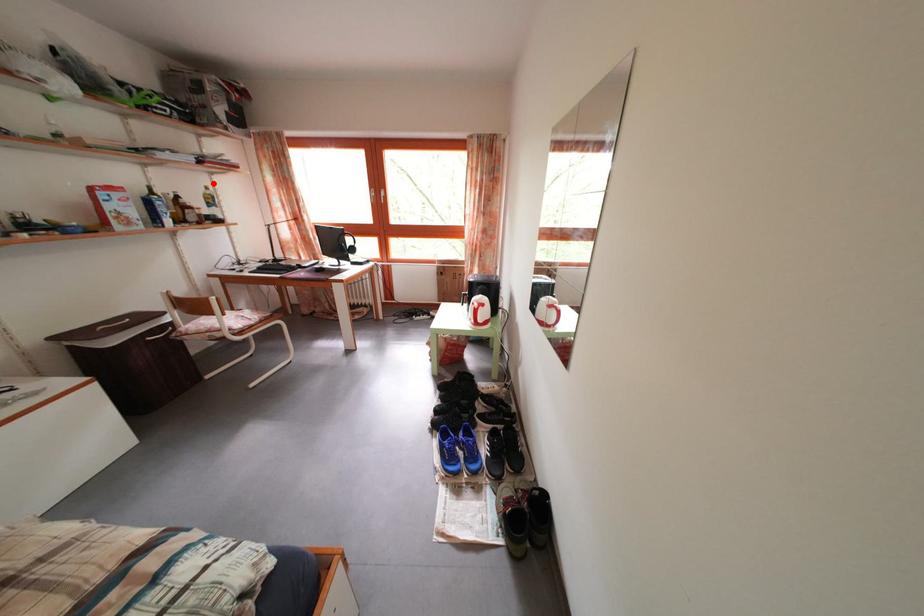
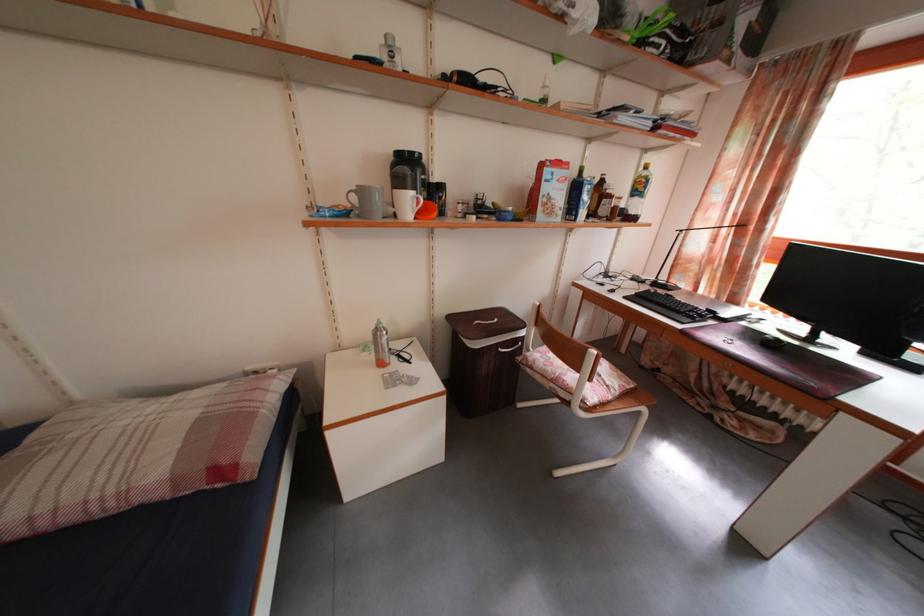
The point at the highlighted location is marked in the first image. Where is the corresponding point in the second image?

(643, 161)